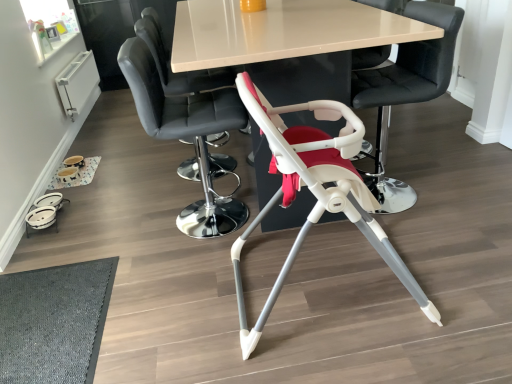
The width and height of the screenshot is (512, 384). Identify the location of vacant area situated to the left side of smooth leather chair at upper center, which is the first chair in left-to-right order. (144, 172).